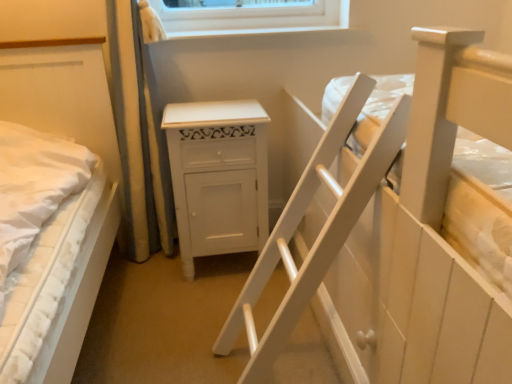
Question: Considering the relative sizes of white wooden bed at upper right, the 1th bed viewed from the right, and white painted wood cabinet at center in the image provided, is white wooden bed at upper right, the 1th bed viewed from the right, taller than white painted wood cabinet at center?

Choices:
 (A) no
 (B) yes

Answer: (B)

Question: Is white wooden bed at upper right, the 2th bed viewed from the left, in front of white painted wood cabinet at center?

Choices:
 (A) no
 (B) yes

Answer: (B)

Question: Considering the relative sizes of white wooden bed at upper right, the 1th bed viewed from the right, and white painted wood cabinet at center in the image provided, is white wooden bed at upper right, the 1th bed viewed from the right, smaller than white painted wood cabinet at center?

Choices:
 (A) no
 (B) yes

Answer: (A)

Question: From the image's perspective, is white wooden bed at upper right, the 1th bed viewed from the right, on white painted wood cabinet at center?

Choices:
 (A) no
 (B) yes

Answer: (B)

Question: From the image's perspective, is white wooden bed at upper right, the 1th bed viewed from the right, located beneath white painted wood cabinet at center?

Choices:
 (A) no
 (B) yes

Answer: (A)

Question: Is point (503, 319) positioned closer to the camera than point (247, 173)?

Choices:
 (A) closer
 (B) farther

Answer: (A)

Question: From the image's perspective, is white wooden bed at upper right, the 2th bed viewed from the left, above or below white painted wood cabinet at center?

Choices:
 (A) above
 (B) below

Answer: (A)

Question: Considering the positions of white wooden bed at upper right, the 1th bed viewed from the right, and white painted wood cabinet at center in the image, is white wooden bed at upper right, the 1th bed viewed from the right, bigger or smaller than white painted wood cabinet at center?

Choices:
 (A) small
 (B) big

Answer: (B)

Question: From their relative heights in the image, would you say white wooden bed at upper right, the 2th bed viewed from the left, is taller or shorter than white painted wood cabinet at center?

Choices:
 (A) tall
 (B) short

Answer: (A)

Question: Is white textured mattress at left, arranged as the 1th bed when viewed from the left, bigger or smaller than white painted wood cabinet at center?

Choices:
 (A) big
 (B) small

Answer: (A)

Question: From the image's perspective, is white textured mattress at left, the 2th bed in the right-to-left sequence, above or below white painted wood cabinet at center?

Choices:
 (A) above
 (B) below

Answer: (B)

Question: Is white textured mattress at left, arranged as the 1th bed when viewed from the left, taller or shorter than white painted wood cabinet at center?

Choices:
 (A) tall
 (B) short

Answer: (A)

Question: In the image, is white textured mattress at left, arranged as the 1th bed when viewed from the left, positioned in front of or behind white painted wood cabinet at center?

Choices:
 (A) behind
 (B) front

Answer: (B)

Question: Considering the relative positions of white wooden bed at upper right, the 1th bed viewed from the right, and white textured mattress at left, the 2th bed in the right-to-left sequence, in the image provided, is white wooden bed at upper right, the 1th bed viewed from the right, to the left or to the right of white textured mattress at left, the 2th bed in the right-to-left sequence,?

Choices:
 (A) right
 (B) left

Answer: (A)

Question: From the image's perspective, is white wooden bed at upper right, the 1th bed viewed from the right, positioned above or below white textured mattress at left, arranged as the 1th bed when viewed from the left?

Choices:
 (A) above
 (B) below

Answer: (A)